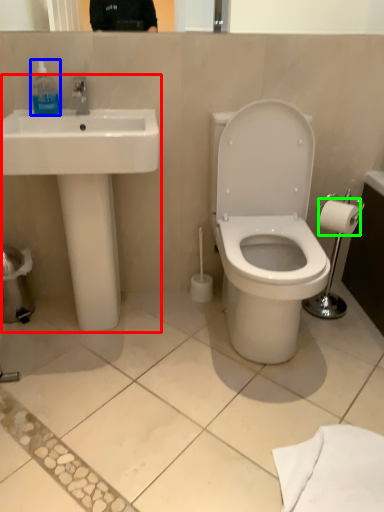
Question: Which object is positioned closest to sink (highlighted by a red box)? Select from toiletry (highlighted by a blue box) and toilet paper (highlighted by a green box).

Choices:
 (A) toiletry
 (B) toilet paper

Answer: (A)